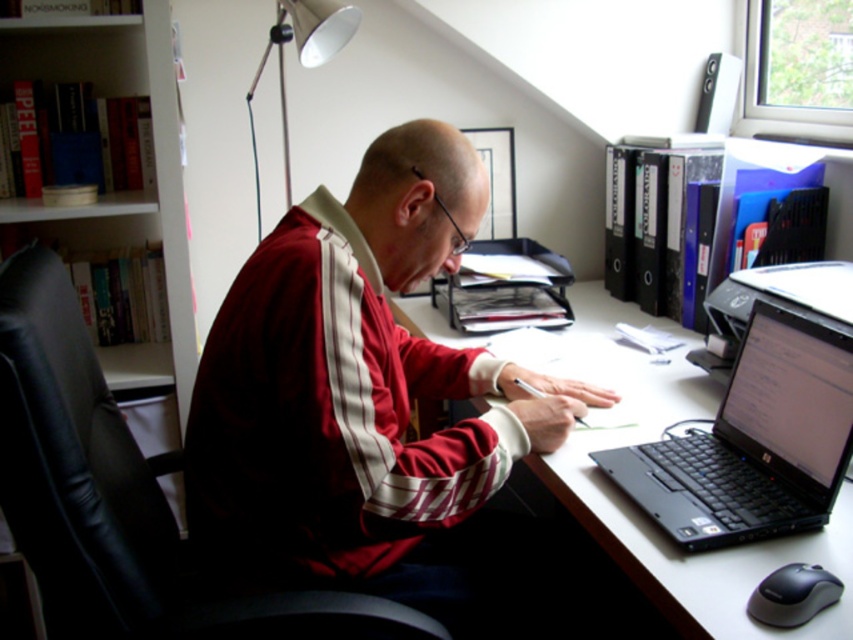
Does matte red tracksuit at center appear over white wooden bookshelf at left?

Incorrect, matte red tracksuit at center is not positioned above white wooden bookshelf at left.

Is matte red tracksuit at center below white wooden bookshelf at left?

Correct, matte red tracksuit at center is located below white wooden bookshelf at left.

This screenshot has height=640, width=853. Find the location of `matte red tracksuit at center`. matte red tracksuit at center is located at coordinates (360, 396).

The width and height of the screenshot is (853, 640). I want to click on matte red tracksuit at center, so click(360, 396).

Is matte red tracksuit at center to the right of black leather swivel chair at left from the viewer's perspective?

Correct, you'll find matte red tracksuit at center to the right of black leather swivel chair at left.

Between matte red tracksuit at center and black leather swivel chair at left, which one appears on the right side from the viewer's perspective?

matte red tracksuit at center is more to the right.

Who is more distant from viewer, (532, 376) or (62, 388)?

Point (532, 376)

Where is `matte red tracksuit at center`? The width and height of the screenshot is (853, 640). matte red tracksuit at center is located at coordinates (360, 396).

Which of these two, white glossy computer desk at center or black plastic mouse at lower right, stands taller?

white glossy computer desk at center is taller.

The image size is (853, 640). What do you see at coordinates (637, 509) in the screenshot? I see `white glossy computer desk at center` at bounding box center [637, 509].

Identify the location of white glossy computer desk at center. The height and width of the screenshot is (640, 853). (637, 509).